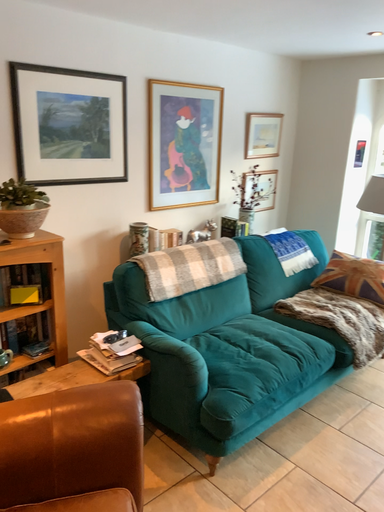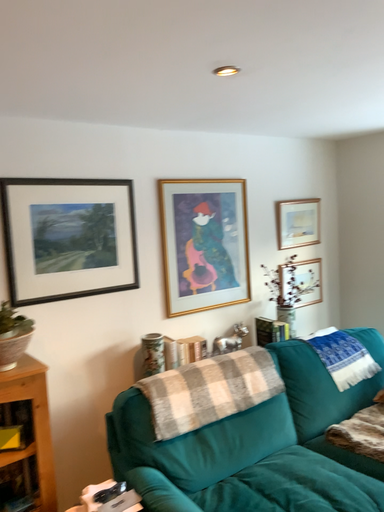
Question: How did the camera likely rotate when shooting the video?

Choices:
 (A) rotated upward
 (B) rotated downward

Answer: (A)